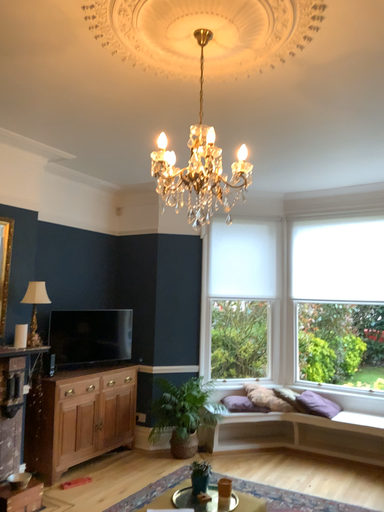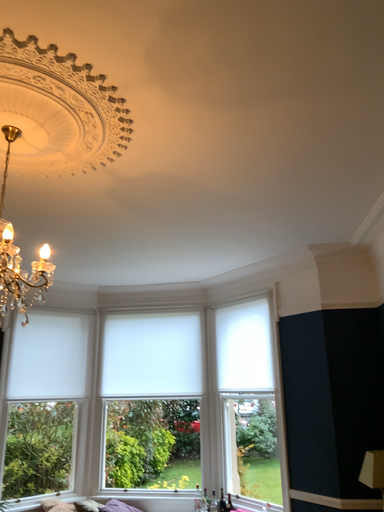
Question: How did the camera likely rotate when shooting the video?

Choices:
 (A) rotated downward
 (B) rotated upward

Answer: (B)